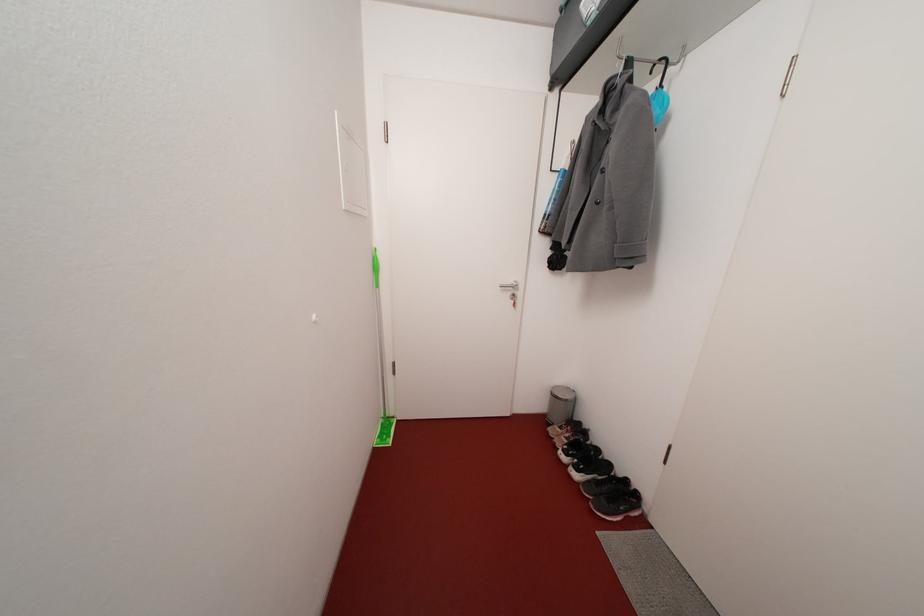
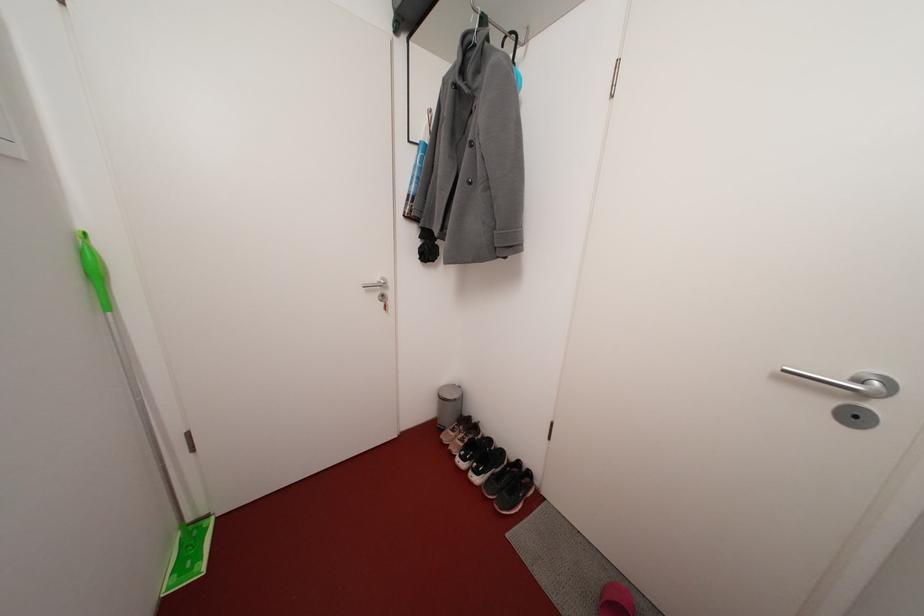
Question: The first image is from the beginning of the video and the second image is from the end. How did the camera likely rotate when shooting the video?

Choices:
 (A) Left
 (B) Right
 (C) Up
 (D) Down

Answer: (B)